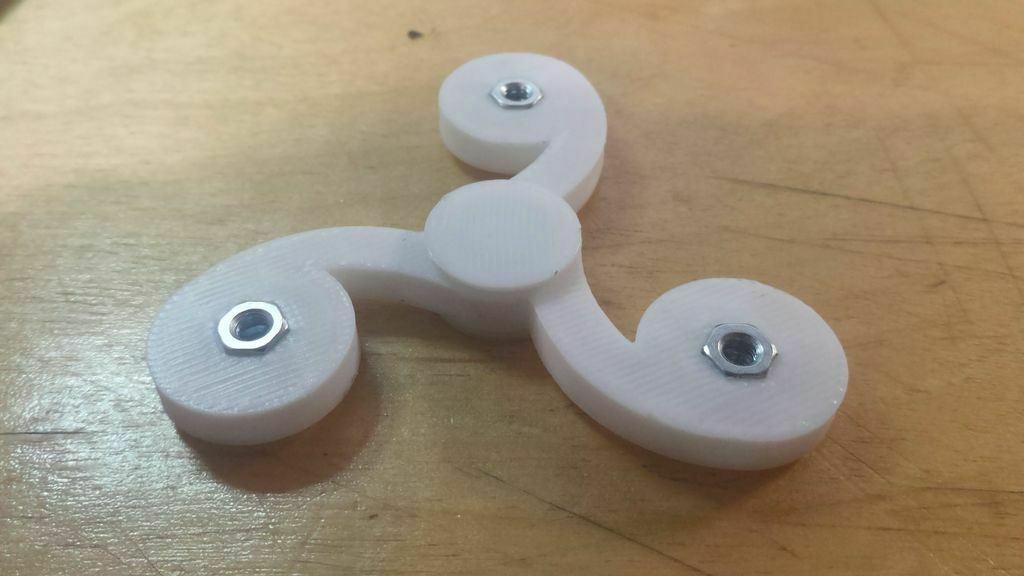
Find the location of a particular element. Image resolution: width=1024 pixels, height=576 pixels. table is located at coordinates (709, 183).